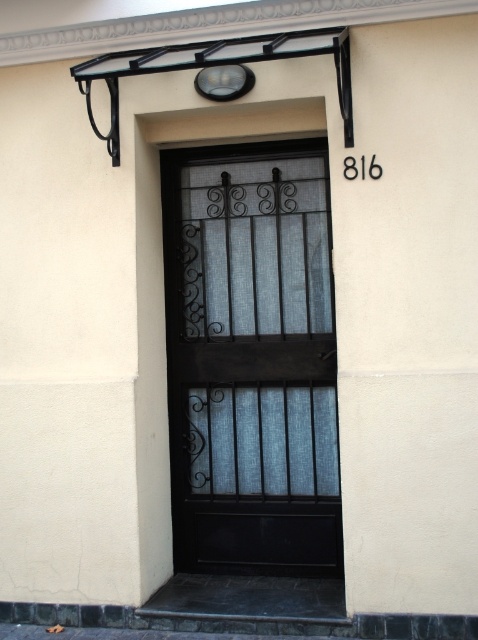
You are standing in front of the building and want to locate the black wrought iron door at center. According to the coordinates provided, where exactly is it positioned on the image?

The black wrought iron door at center is located at the coordinates point (251, 358).